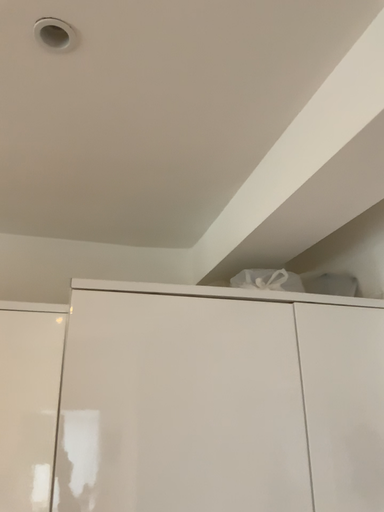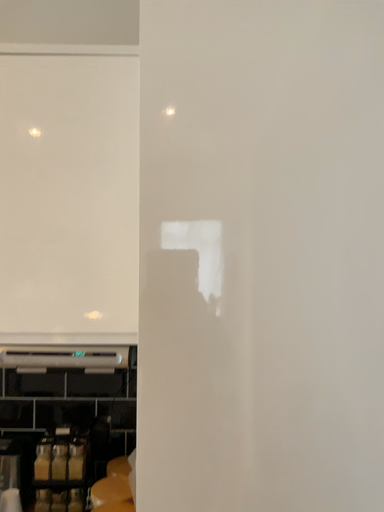
Question: Which way did the camera rotate in the video?

Choices:
 (A) rotated upward
 (B) rotated downward

Answer: (B)